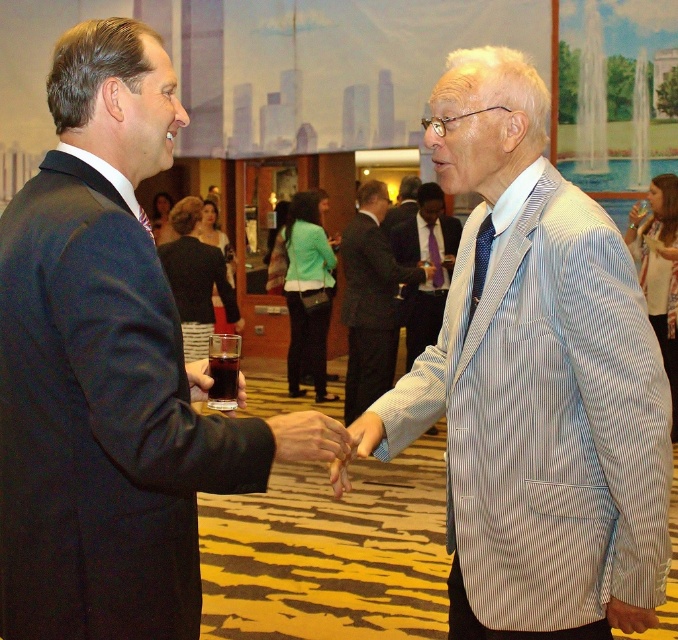
Who is more distant from viewer, (340, 241) or (233, 412)?

Positioned behind is point (340, 241).

What are the coordinates of `light blue striped blazer at center` in the screenshot? It's located at (370, 300).

Between point (418, 342) and point (195, 365), which one is positioned behind?

Point (418, 342)

Does striped cotton blazer at center have a larger size compared to translucent glass at center?

Indeed, striped cotton blazer at center has a larger size compared to translucent glass at center.

At what (x,y) coordinates should I click in order to perform the action: click on striped cotton blazer at center. Please return your answer as a coordinate pair (x, y). The height and width of the screenshot is (640, 678). Looking at the image, I should click on (428, 262).

Where is `striped cotton blazer at center`? Image resolution: width=678 pixels, height=640 pixels. striped cotton blazer at center is located at coordinates (428, 262).

Can you confirm if matte black suit at center is bigger than translucent glass at center?

Indeed, matte black suit at center has a larger size compared to translucent glass at center.

Is point (75, 556) more distant than point (193, 365)?

No, it is not.

Is point (98, 289) closer to camera compared to point (205, 390)?

Yes, point (98, 289) is closer to viewer.

Where is `matte black suit at center`? The image size is (678, 640). matte black suit at center is located at coordinates (108, 371).